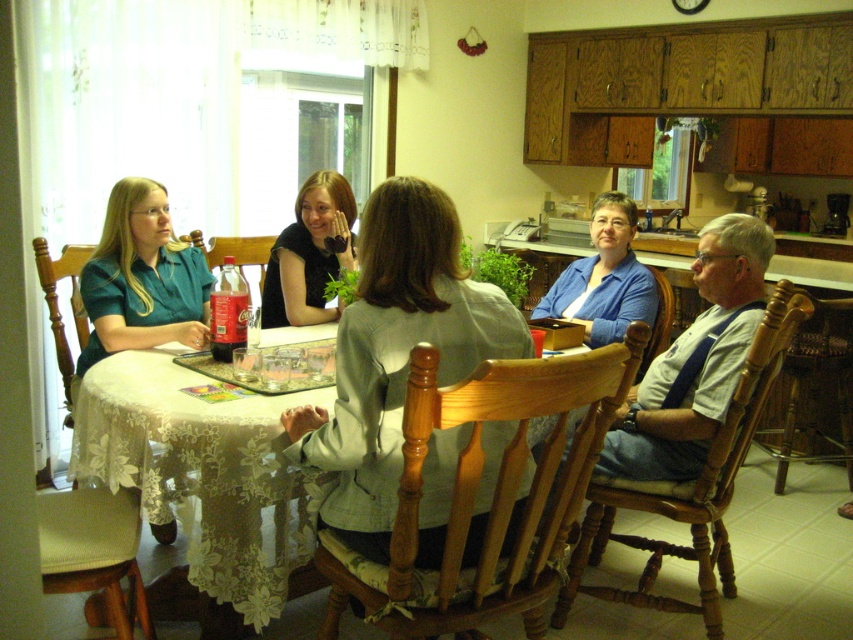
You are sitting at the round wooden table and want to pass a napkin from the matte teal blouse at left to the matte black shirt at center. Can you slide it directly across the table without moving any items in the way?

The matte teal blouse at left is positioned under the matte black shirt at center, so sliding the napkin directly across the table might be possible as long as there are no obstructing items between them. However, the description does not mention any table items blocking the path, so it should be feasible.